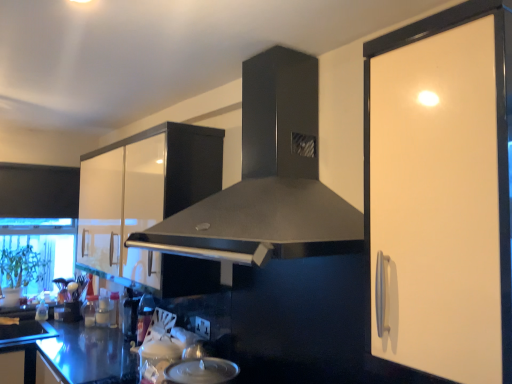
Identify the location of vacant region above matte black range hood at center (from a real-world perspective). This screenshot has height=384, width=512. pyautogui.click(x=246, y=39).